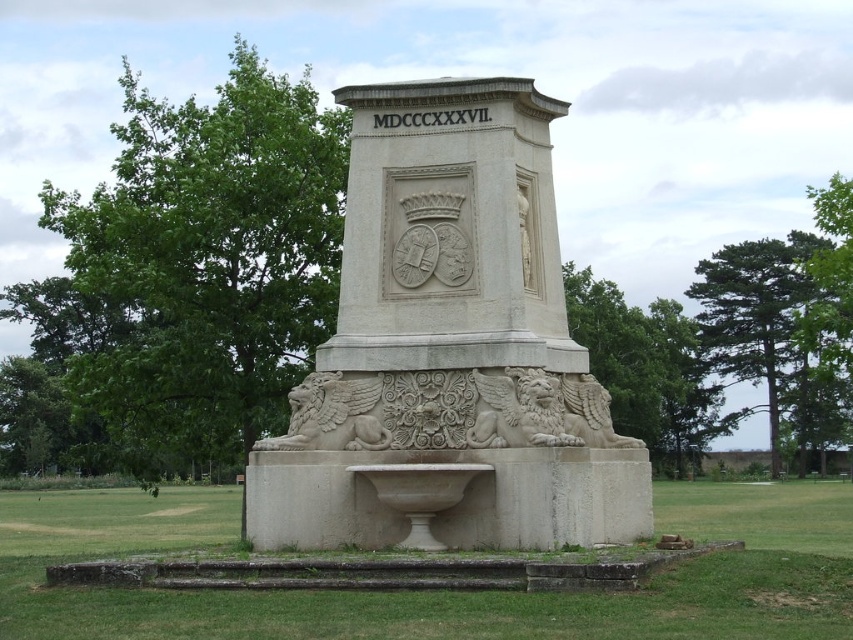
You are a landscape architect designing a pathway between the white stone fountain at center and the white stone basin at center. What is the minimum width the pathway needs to be to ensure a 1 meter buffer on both sides of the objects?

The white stone fountain at center and white stone basin at center are 25.77 meters apart. To ensure a 1 meter buffer on both sides, the pathway must be at least 25.77 meters plus 2 meters, totaling 27.77 meters wide.

You are an architect designing a new garden layout and need to place a statue between the white stone fountain at center and the white stone basin at center. Since the statue requires a 2 meter wide space, can you determine which object you should place it next to to ensure enough space?

The white stone fountain at center is wider than the white stone basin at center. Therefore, placing the statue next to the white stone fountain at center would provide sufficient space as its width exceeds 2 meters.